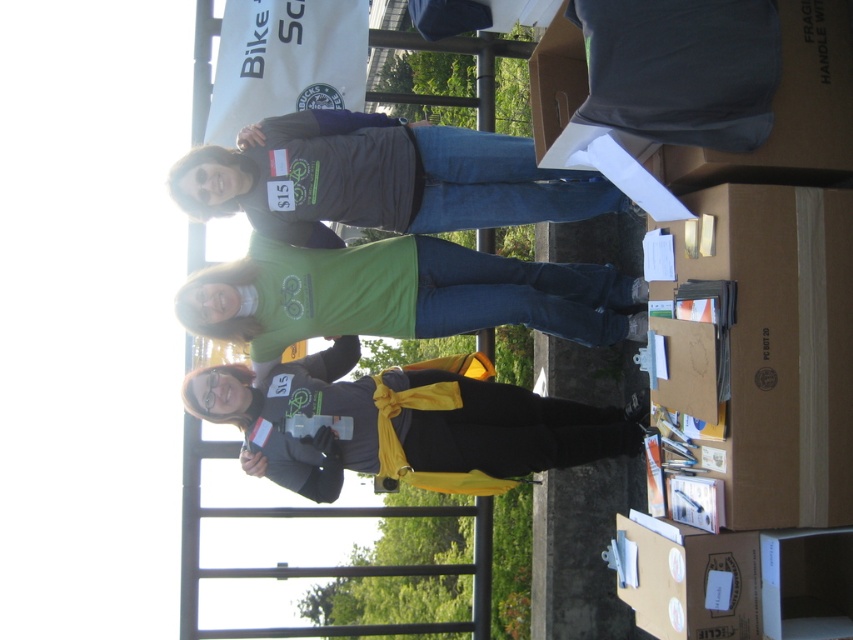
Looking at this image, you are a photographer at the event. You need to capture a photo where both the matte gray shirt at center and the green matte shirt at center are clearly visible. Based on their positions, which shirt should you focus on first to ensure both are in frame?

The matte gray shirt at center is above the green matte shirt at center, so focusing on the matte gray shirt at center first will ensure both are in frame as the green matte shirt at center is below it.

You are organizing a small outdoor event and need to place a brown cardboard box at lower right and a matte black jacket at center. Given their sizes, which item should you choose if you need to place something wider on the table?

The matte black jacket at center should be chosen because it is wider than the brown cardboard box at lower right.